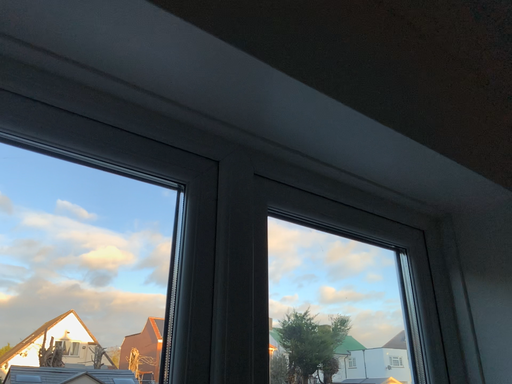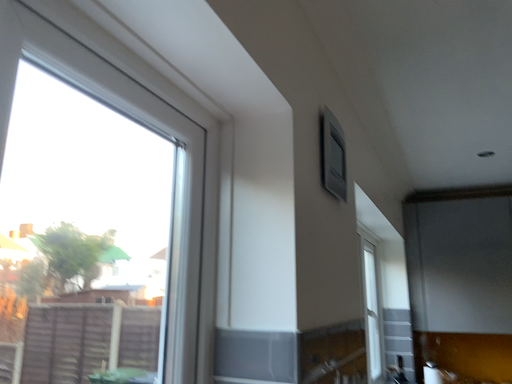
Question: How did the camera likely rotate when shooting the video?

Choices:
 (A) rotated left
 (B) rotated right

Answer: (B)